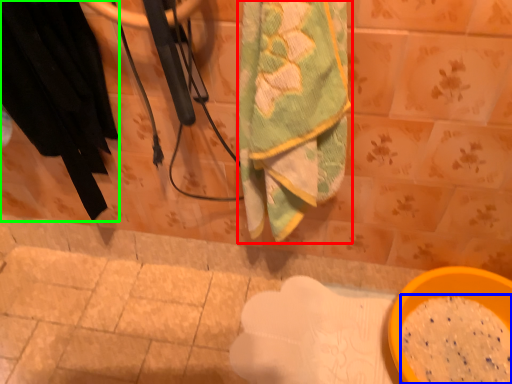
Question: Estimate the real-world distances between objects in this image. Which object is farther from towel (highlighted by a red box), powder (highlighted by a blue box) or clothing (highlighted by a green box)?

Choices:
 (A) powder
 (B) clothing

Answer: (A)